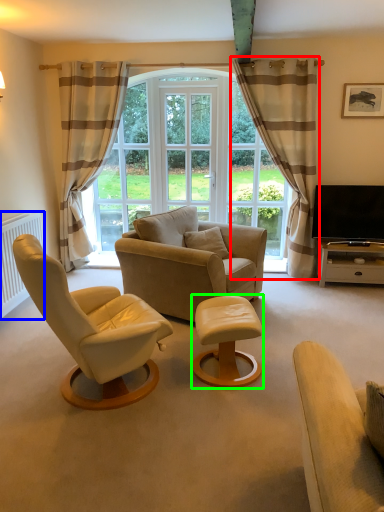
Question: Which object is positioned closest to curtain (highlighted by a red box)? Select from radiator (highlighted by a blue box) and table (highlighted by a green box).

Choices:
 (A) radiator
 (B) table

Answer: (B)